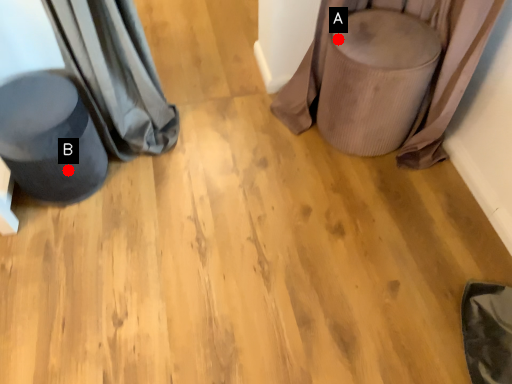
Question: Two points are circled on the image, labeled by A and B beside each circle. Which of the following is the closest to the observer?

Choices:
 (A) A is closer
 (B) B is closer

Answer: (B)